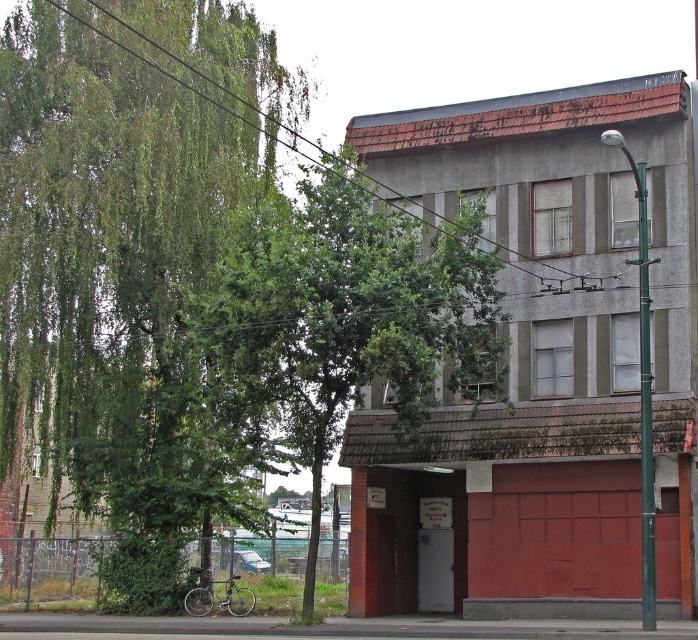
The width and height of the screenshot is (698, 640). What do you see at coordinates (128, 253) in the screenshot?
I see `green leafy tree at left` at bounding box center [128, 253].

Is green leafy tree at left below green leafy tree at center?

Actually, green leafy tree at left is above green leafy tree at center.

Between point (118, 289) and point (473, 204), which one is positioned behind?

The point (118, 289) is behind.

Locate an element on the screen. The image size is (698, 640). green leafy tree at left is located at coordinates (128, 253).

Is green leafy tree at left smaller than green metallic pole at right?

No, green leafy tree at left is not smaller than green metallic pole at right.

Who is more forward, (135, 458) or (653, 518)?

Point (653, 518) is more forward.

Image resolution: width=698 pixels, height=640 pixels. Identify the location of green leafy tree at left. (128, 253).

Between point (408, 374) and point (646, 472), which one is positioned behind?

Point (408, 374)

Who is higher up, green leafy tree at center or green metallic pole at right?

green metallic pole at right is above.

You are a GUI agent. You are given a task and a screenshot of the screen. Output one action in this format:
    pyautogui.click(x=<x>, y=<y>)
    Task: Click on the green leafy tree at center
    The height and width of the screenshot is (640, 698).
    Given the screenshot: What is the action you would take?
    pyautogui.click(x=350, y=314)

This screenshot has width=698, height=640. I want to click on green leafy tree at center, so click(x=350, y=314).